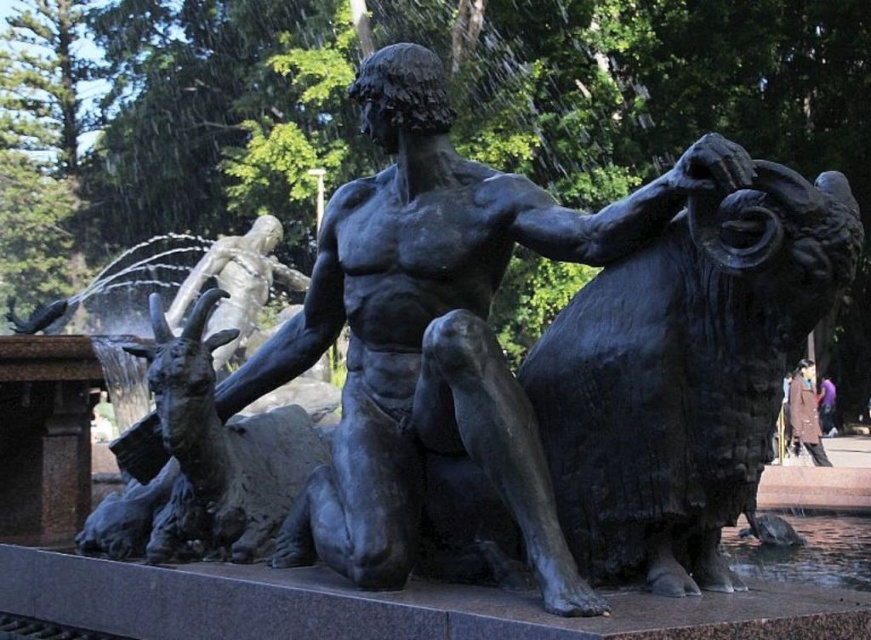
What is located at the coordinates point (437,330) in the image?

The bronze muscular figure at center is located at point (437,330).

You are a park visitor holding a small backpack. You want to place your backpack on the ground near the bronze muscular figure at center without blocking the view of the brown leather jacket at lower right. Is this possible?

The bronze muscular figure at center is above the brown leather jacket at lower right, so placing the backpack near the base of the bronze muscular figure at center would keep it from blocking the jacket view.

You are a park maintenance worker who needs to move the brown leather jacket at lower right to the bronze muscular figure at center. Given that your cart can carry items up to 35 meters in distance, will you be able to transport it without exceeding the cart capacity?

The bronze muscular figure at center and brown leather jacket at lower right are 35.78 meters apart from each other. Since the distance exceeds the cart capacity of 35 meters, you will not be able to transport the jacket without exceeding the cart capacity.